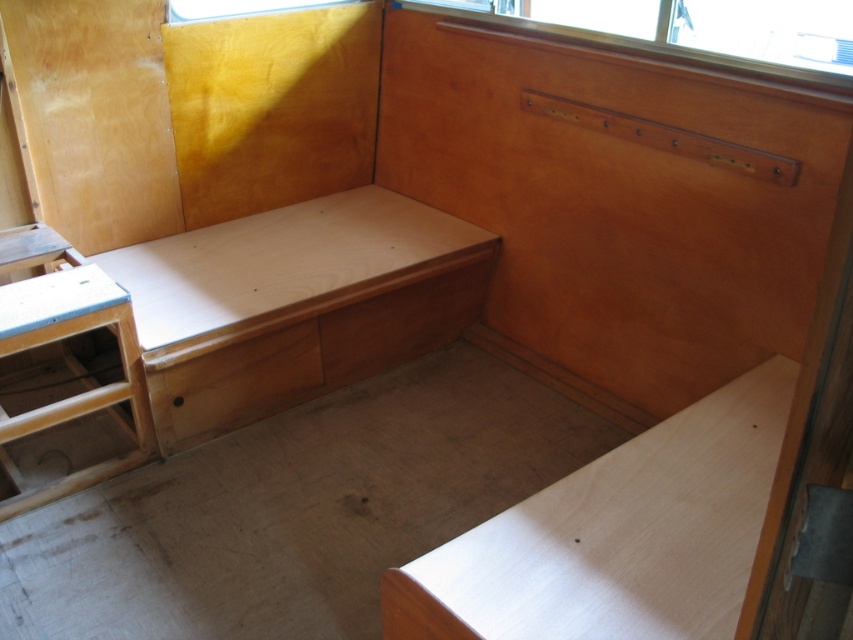
Question: Based on their relative distances, which object is nearer to the natural wood bench at center?

Choices:
 (A) natural wood stool at lower left
 (B) light brown wood table at lower right

Answer: (A)

Question: Is natural wood bench at center to the right of natural wood drawer at center from the viewer's perspective?

Choices:
 (A) no
 (B) yes

Answer: (B)

Question: Which of the following is the closest to the observer?

Choices:
 (A) (212, 237)
 (B) (18, 301)

Answer: (B)

Question: Is light brown wood table at lower right closer to the viewer compared to natural wood drawer at center?

Choices:
 (A) no
 (B) yes

Answer: (B)

Question: Estimate the real-world distances between objects in this image. Which object is closer to the natural wood bench at center?

Choices:
 (A) light brown wood table at lower right
 (B) natural wood drawer at center

Answer: (B)

Question: Is natural wood bench at center positioned before wooden drawer at center?

Choices:
 (A) no
 (B) yes

Answer: (B)